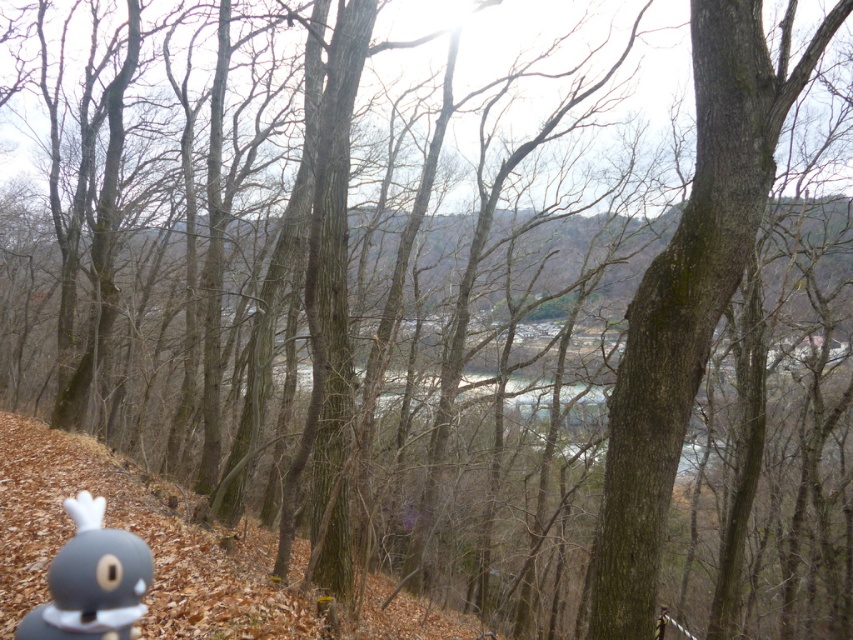
Question: Which point is closer to the camera?

Choices:
 (A) (781, 40)
 (B) (132, 608)

Answer: (B)

Question: Which point is farther to the camera?

Choices:
 (A) (122, 540)
 (B) (631, 454)

Answer: (B)

Question: Which object is farther from the camera taking this photo?

Choices:
 (A) brown rough bark tree at center
 (B) gray matte toy at lower left

Answer: (A)

Question: Is brown rough bark tree at center closer to camera compared to gray matte toy at lower left?

Choices:
 (A) no
 (B) yes

Answer: (A)

Question: Is brown rough bark tree at center to the left of gray matte toy at lower left from the viewer's perspective?

Choices:
 (A) yes
 (B) no

Answer: (B)

Question: From the image, what is the correct spatial relationship of brown rough bark tree at center in relation to gray matte toy at lower left?

Choices:
 (A) below
 (B) above

Answer: (B)